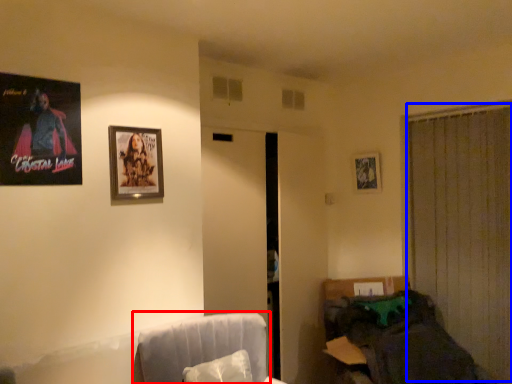
Question: Which object is closer to the camera taking this photo, swivel chair (highlighted by a red box) or curtain (highlighted by a blue box)?

Choices:
 (A) swivel chair
 (B) curtain

Answer: (A)